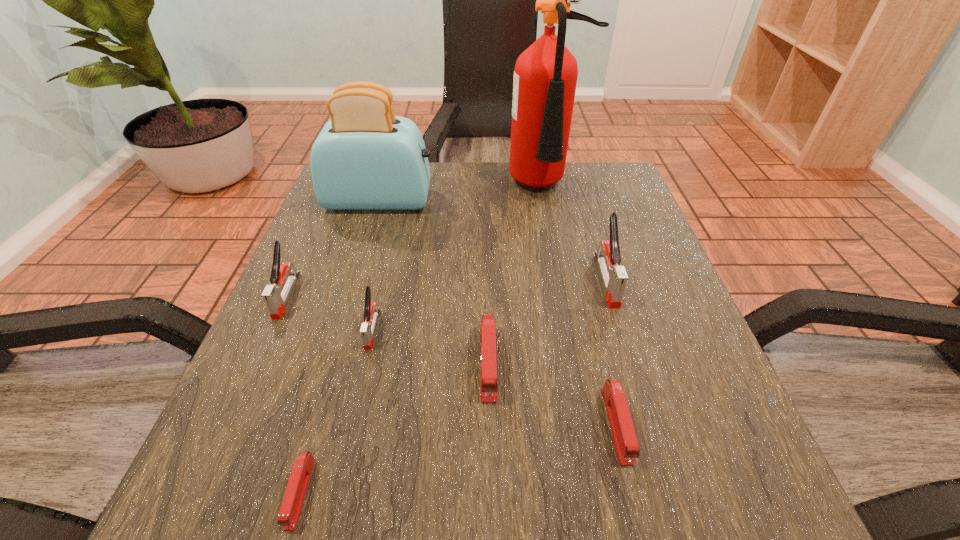
This screenshot has width=960, height=540. Find the location of `empty location between the fifth object from left to right and the second smallest gray stapler`. empty location between the fifth object from left to right and the second smallest gray stapler is located at coordinates (388, 329).

Locate an element on the screen. This screenshot has height=540, width=960. blank region between the shortest object and the third shortest object is located at coordinates (395, 428).

Image resolution: width=960 pixels, height=540 pixels. In order to click on free spot between the tallest object and the light toaster in this screenshot , I will do `click(464, 194)`.

At what (x,y) coordinates should I click in order to perform the action: click on blank region between the leftmost stapler and the biggest red stapler. Please return your answer as a coordinate pair (x, y). Looking at the image, I should click on (388, 329).

The width and height of the screenshot is (960, 540). What are the coordinates of `free point between the third shortest object and the toaster` in the screenshot? It's located at (434, 281).

Find the location of a particular element. free space between the second red stapler from right to left and the smallest red stapler is located at coordinates (395, 428).

Locate which object is the sixth closest to the second red stapler from right to left. Please provide its 2D coordinates. Your answer should be formatted as a tuple, i.e. [(x, y)], where the tuple contains the x and y coordinates of a point satisfying the conditions above.

[(275, 299)]

Identify the location of the third closest object to the second stapler from left to right. The width and height of the screenshot is (960, 540). (275, 299).

Find the location of a particular element. This screenshot has height=540, width=960. the second closest stapler to the third stapler from right to left is located at coordinates (371, 311).

Identify which stapler is the second nearest to the tallest object. Please provide its 2D coordinates. Your answer should be formatted as a tuple, i.e. [(x, y)], where the tuple contains the x and y coordinates of a point satisfying the conditions above.

[(489, 384)]